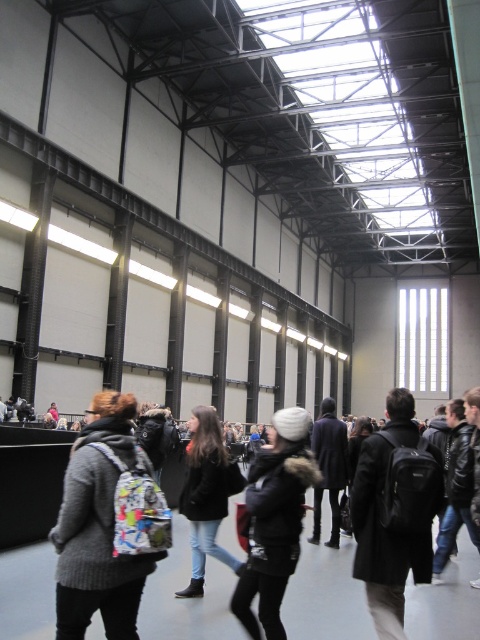
Question: Among these points, which one is nearest to the camera?

Choices:
 (A) (68, 616)
 (B) (360, 467)
 (C) (220, 458)

Answer: (A)

Question: Which point appears farthest from the camera in this image?

Choices:
 (A) (397, 400)
 (B) (83, 481)
 (C) (236, 563)

Answer: (C)

Question: Which point appears closest to the camera in this image?

Choices:
 (A) (384, 604)
 (B) (106, 429)
 (C) (278, 435)
 (D) (197, 444)

Answer: (B)

Question: Does knitted gray sweater at center appear on the right side of black matte backpack at center?

Choices:
 (A) yes
 (B) no

Answer: (B)

Question: Where is knitted gray sweater at center located in relation to black fuzzy jacket at center in the image?

Choices:
 (A) right
 (B) left

Answer: (B)

Question: Is knitted gray sweater at center wider than black matte backpack at center?

Choices:
 (A) no
 (B) yes

Answer: (A)